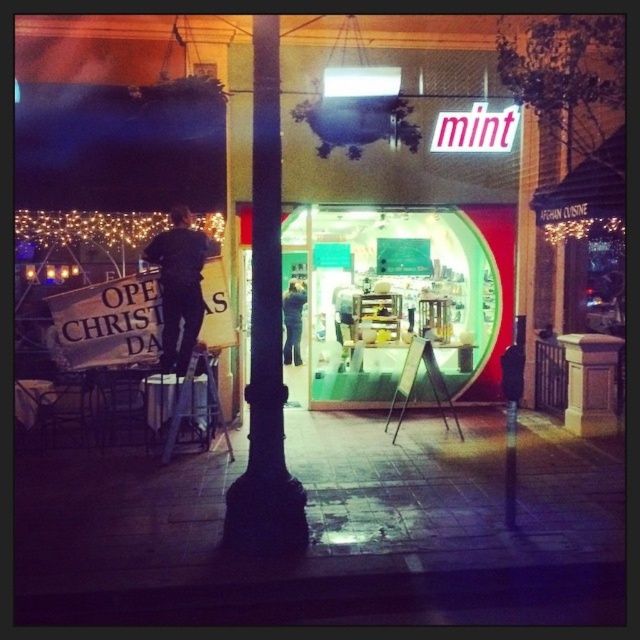
You are a customer entering the mint storefront and notice the black matte pole at center and dark blue jeans at left. Which object is wider?

The black matte pole at center is wider than the dark blue jeans at left.

You are standing in front of the mint storefront and want to touch both points mentioned. Which point should you reach for first, the point at coordinate [259,76] or the point at coordinate [150,256]?

You should reach for the point at coordinate [259,76] first because it is closer to you than the point at coordinate [150,256].